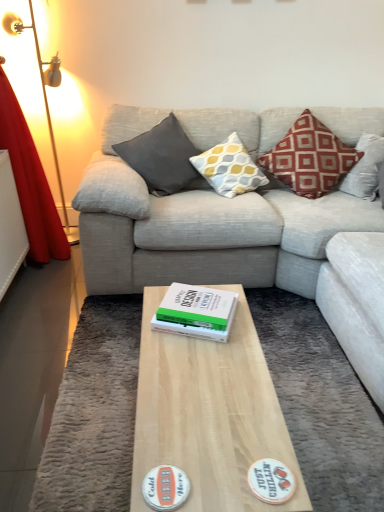
Question: Can you confirm if red velvet curtain at left is shorter than light gray fabric couch at center?

Choices:
 (A) no
 (B) yes

Answer: (A)

Question: Would you say red velvet curtain at left is a long distance from light gray fabric couch at center?

Choices:
 (A) no
 (B) yes

Answer: (B)

Question: Is red velvet curtain at left turned away from light gray fabric couch at center?

Choices:
 (A) no
 (B) yes

Answer: (A)

Question: Is light gray fabric couch at center a part of red velvet curtain at left?

Choices:
 (A) no
 (B) yes

Answer: (A)

Question: Considering the relative sizes of red velvet curtain at left and light gray fabric couch at center in the image provided, is red velvet curtain at left smaller than light gray fabric couch at center?

Choices:
 (A) no
 (B) yes

Answer: (B)

Question: Is red velvet curtain at left not within light gray fabric couch at center?

Choices:
 (A) yes
 (B) no

Answer: (A)

Question: Does red velvet curtain at left have a greater height compared to white matte sticker at center, the second sticker in the left-to-right sequence?

Choices:
 (A) yes
 (B) no

Answer: (A)

Question: Is red velvet curtain at left placed right next to white matte sticker at center, which is the 1th sticker in right-to-left order?

Choices:
 (A) no
 (B) yes

Answer: (A)

Question: Is red velvet curtain at left to the right of white matte sticker at center, the second sticker in the left-to-right sequence, from the viewer's perspective?

Choices:
 (A) yes
 (B) no

Answer: (B)

Question: Does red velvet curtain at left have a smaller size compared to white matte sticker at center, the second sticker in the left-to-right sequence?

Choices:
 (A) no
 (B) yes

Answer: (A)

Question: Does red velvet curtain at left have a larger size compared to white matte sticker at center, which is the 1th sticker in right-to-left order?

Choices:
 (A) no
 (B) yes

Answer: (B)

Question: From a real-world perspective, is red velvet curtain at left under white matte sticker at center, which is the 1th sticker in right-to-left order?

Choices:
 (A) no
 (B) yes

Answer: (A)

Question: From a real-world perspective, is matte gray cushion at center, the first pillow when ordered from left to right, under red velvet curtain at left?

Choices:
 (A) no
 (B) yes

Answer: (B)